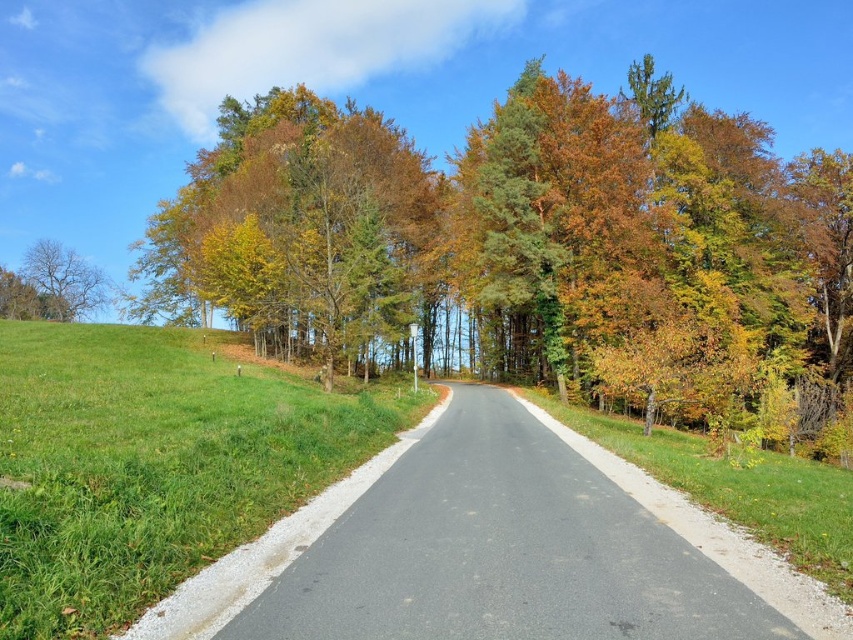
In the scene shown: Can you confirm if green grass at right is bigger than bare branches at left?

Incorrect, green grass at right is not larger than bare branches at left.

What do you see at coordinates (740, 488) in the screenshot? This screenshot has width=853, height=640. I see `green grass at right` at bounding box center [740, 488].

I want to click on green grass at right, so click(x=740, y=488).

Is green leafy tree at center further to camera compared to green grass at right?

Yes, it is behind green grass at right.

Which is behind, point (601, 220) or point (808, 502)?

The point (601, 220) is more distant.

This screenshot has height=640, width=853. In order to click on green leafy tree at center in this screenshot , I will do `click(534, 250)`.

Which is below, green grass at left or green grass at right?

Positioned lower is green grass at right.

Who is higher up, green grass at left or green grass at right?

green grass at left is above.

Is point (73, 477) more distant than point (605, 416)?

No, (73, 477) is in front of (605, 416).

At what (x,y) coordinates should I click in order to perform the action: click on green grass at left. Please return your answer as a coordinate pair (x, y). Looking at the image, I should click on [x=152, y=465].